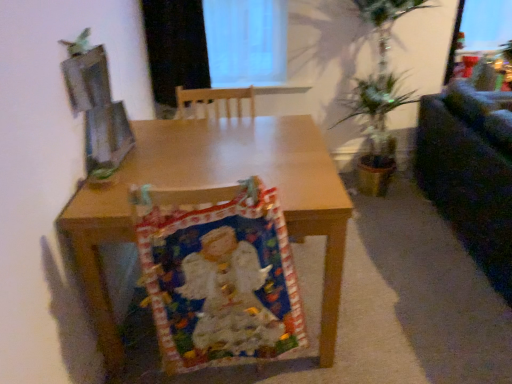
At what (x,y) coordinates should I click in order to perform the action: click on free location to the right of wooden desk at center. Please return your answer as a coordinate pair (x, y). The image size is (512, 384). Looking at the image, I should click on (399, 289).